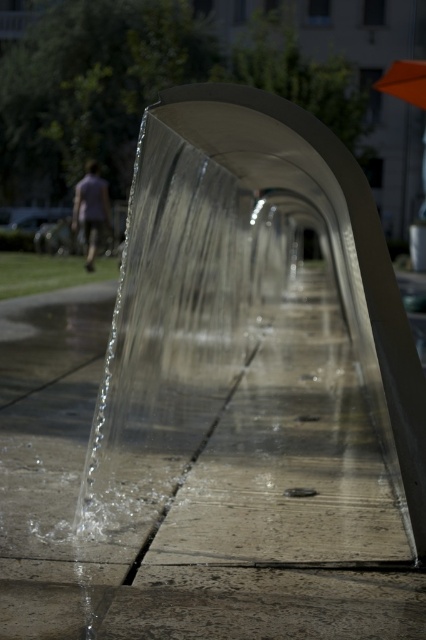
Question: Which object is the farthest from the light purple shirt at left?

Choices:
 (A) orange fabric umbrella at upper right
 (B) smooth concrete pavement at center

Answer: (B)

Question: Estimate the real-world distances between objects in this image. Which object is closer to the smooth concrete pavement at center?

Choices:
 (A) light purple shirt at left
 (B) orange fabric umbrella at upper right

Answer: (A)

Question: Which object is closer to the camera taking this photo?

Choices:
 (A) orange fabric umbrella at upper right
 (B) light purple shirt at left
 (C) smooth concrete pavement at center

Answer: (C)

Question: Is smooth concrete pavement at center to the left of light purple shirt at left from the viewer's perspective?

Choices:
 (A) yes
 (B) no

Answer: (B)

Question: From the image, what is the correct spatial relationship of smooth concrete pavement at center in relation to light purple shirt at left?

Choices:
 (A) below
 (B) above

Answer: (A)

Question: Is the position of smooth concrete pavement at center more distant than that of light purple shirt at left?

Choices:
 (A) yes
 (B) no

Answer: (B)